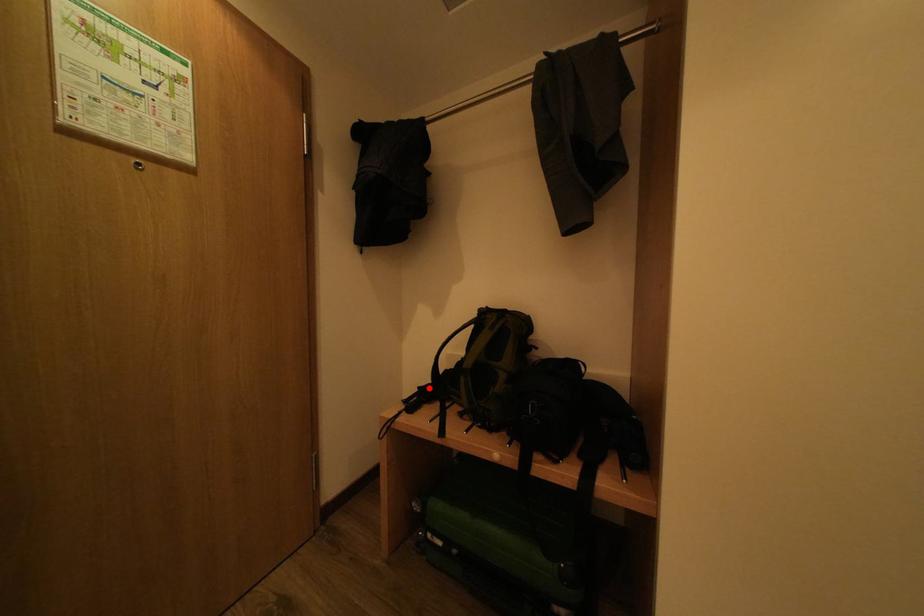
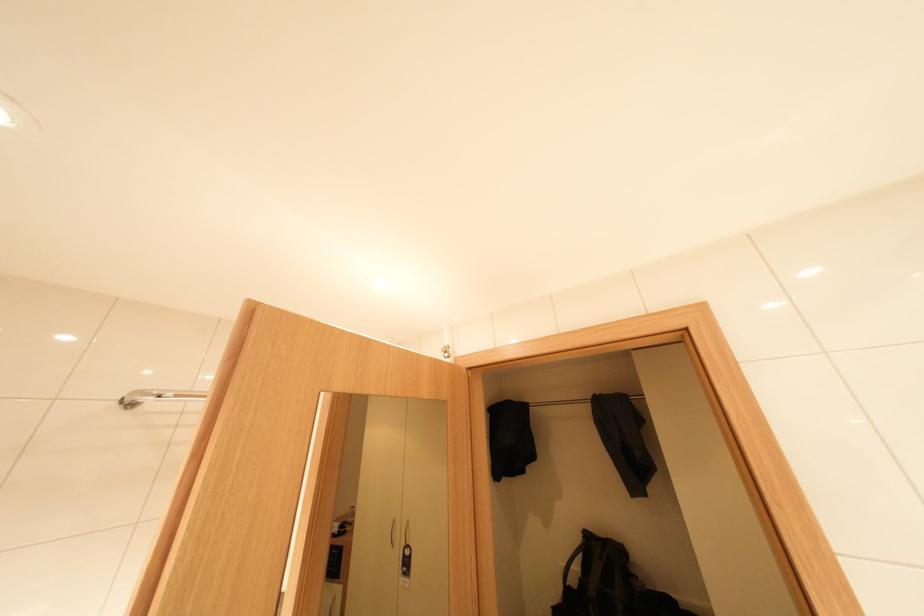
Where in the second image is the point corresponding to the highlighted location from the first image?

(563, 609)